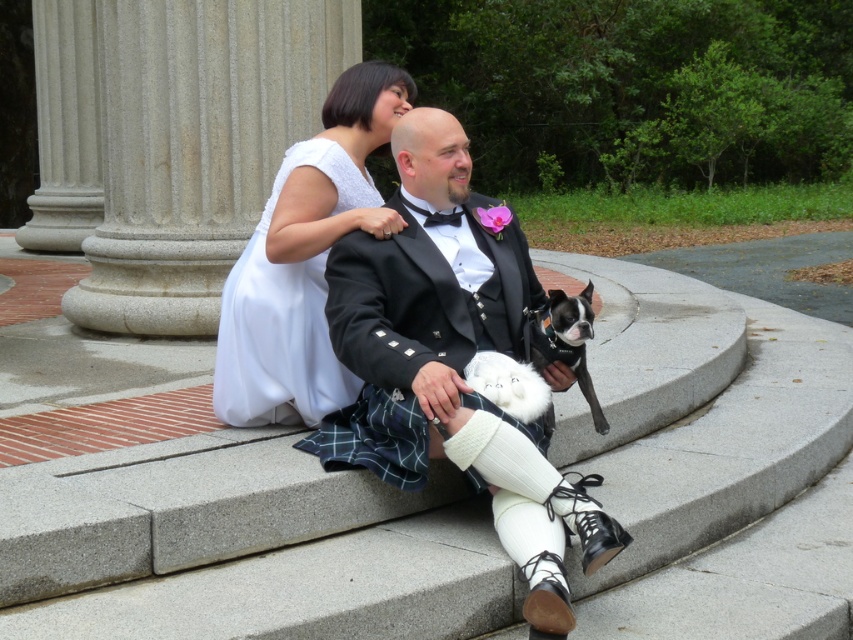
You are a photographer taking a picture of the black glossy dog at center and the white fluffy dog at center. Which dog should you focus on first if you want to capture the one closer to the left side?

The white fluffy dog at center is on the left side of the black glossy dog at center, so you should focus on the white fluffy dog at center first to capture the one closer to the left side.

You are taking a photo of the scene and want to focus on both point [579,358] and point [498,392]. Which point is closer to the camera?

Point [579,358] is further to the camera than point [498,392], so point [498,392] is closer to the camera.

You are a photographer taking a picture of the scene. You need to ensure that both the white sheer dress at center and the black glossy dog at center are in focus. Which one should you focus on first to make sure both are sharp?

The white sheer dress at center is located above the black glossy dog at center, so focusing on the white sheer dress at center first will ensure both are in focus as the dog is below it.